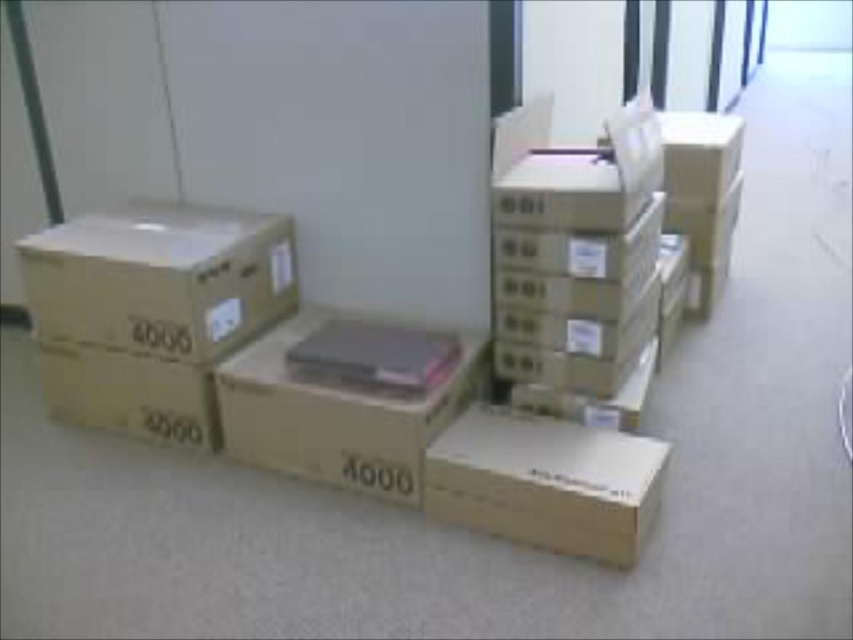
Question: Is brown cardboard box at left thinner than brown cardboard box at center?

Choices:
 (A) no
 (B) yes

Answer: (A)

Question: Which object is positioned closest to the brown cardboard box at left?

Choices:
 (A) brown cardboard box at lower center
 (B) brown cardboard box at center

Answer: (B)

Question: Which of the following is the farthest from the observer?

Choices:
 (A) brown cardboard box at center
 (B) brown cardboard box at left

Answer: (B)

Question: Is brown cardboard box at left to the right of brown cardboard box at lower center from the viewer's perspective?

Choices:
 (A) yes
 (B) no

Answer: (B)

Question: Does brown cardboard box at left appear over brown cardboard box at lower center?

Choices:
 (A) no
 (B) yes

Answer: (B)

Question: Which object appears closest to the camera in this image?

Choices:
 (A) brown cardboard box at left
 (B) brown cardboard box at lower center

Answer: (B)